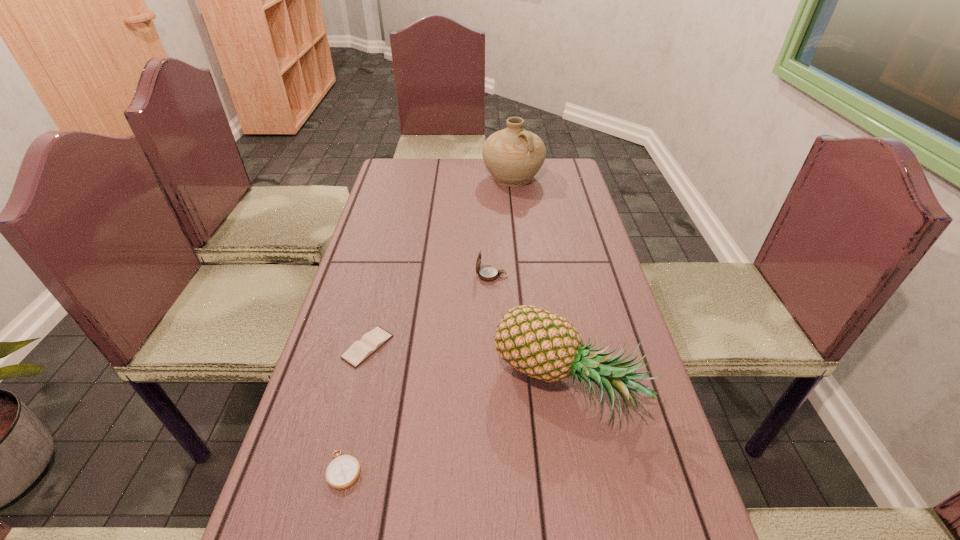
Where is `object that is at the far right corner`? Image resolution: width=960 pixels, height=540 pixels. object that is at the far right corner is located at coordinates (513, 156).

In the image, there is a desktop. Identify the location of vacant space at the far edge. (466, 166).

This screenshot has height=540, width=960. In order to click on vacant space at the left edge in this screenshot , I will do `click(347, 328)`.

In order to click on free spot at the right edge of the desktop in this screenshot , I will do `click(568, 192)`.

Locate an element on the screen. The width and height of the screenshot is (960, 540). vacant space at the far left corner of the desktop is located at coordinates (386, 174).

Find the location of `free space between the nearest object and the taller compass`. free space between the nearest object and the taller compass is located at coordinates (419, 373).

I want to click on empty space that is in between the third tallest object and the pottery, so click(502, 227).

The height and width of the screenshot is (540, 960). I want to click on free space that is in between the diary and the farthest object, so click(x=441, y=262).

Where is `free space that is in between the fourth shortest object and the nearest object`? The height and width of the screenshot is (540, 960). free space that is in between the fourth shortest object and the nearest object is located at coordinates (456, 428).

I want to click on vacant area between the tallest object and the fourth nearest object, so click(502, 227).